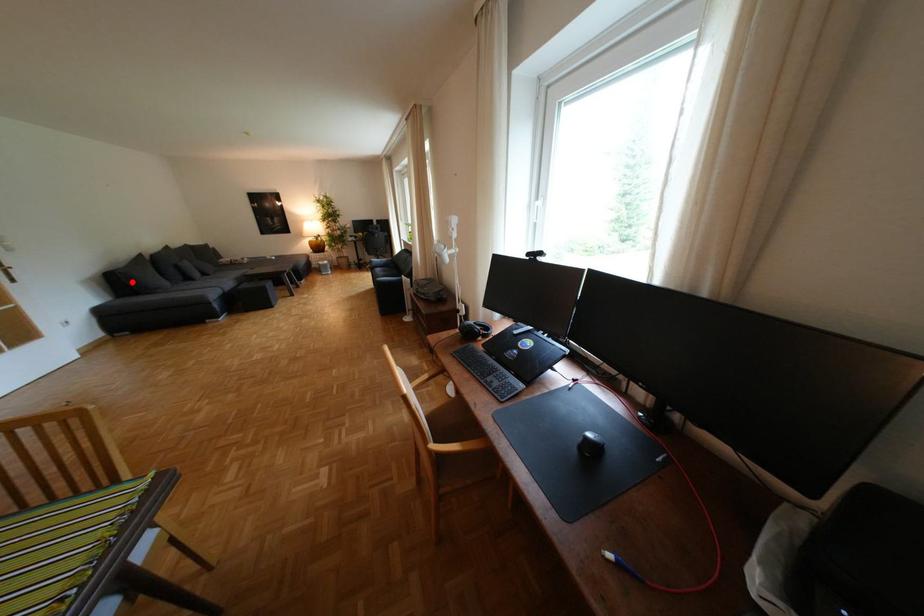
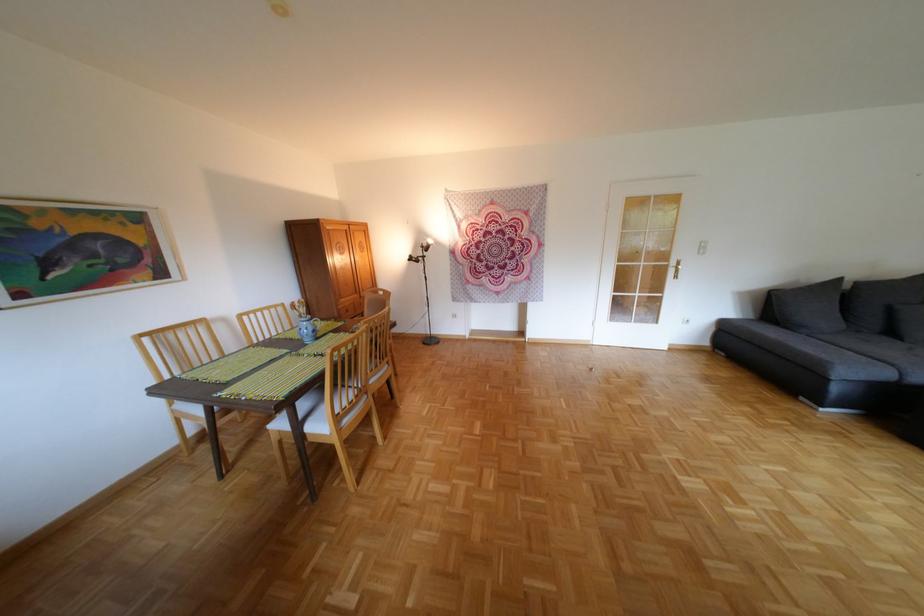
Locate, in the second image, the point that corresponds to the highlighted location in the first image.

(787, 304)